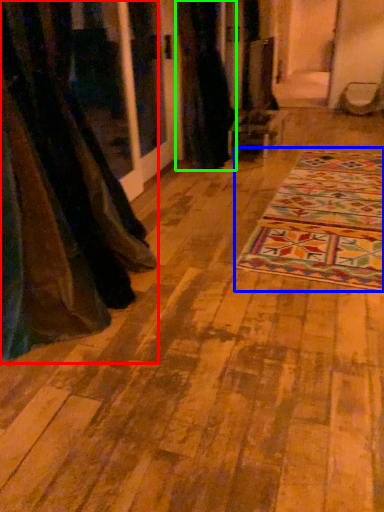
Question: Which is farther away from curtain (highlighted by a red box)? mat (highlighted by a blue box) or curtain (highlighted by a green box)?

Choices:
 (A) mat
 (B) curtain

Answer: (B)